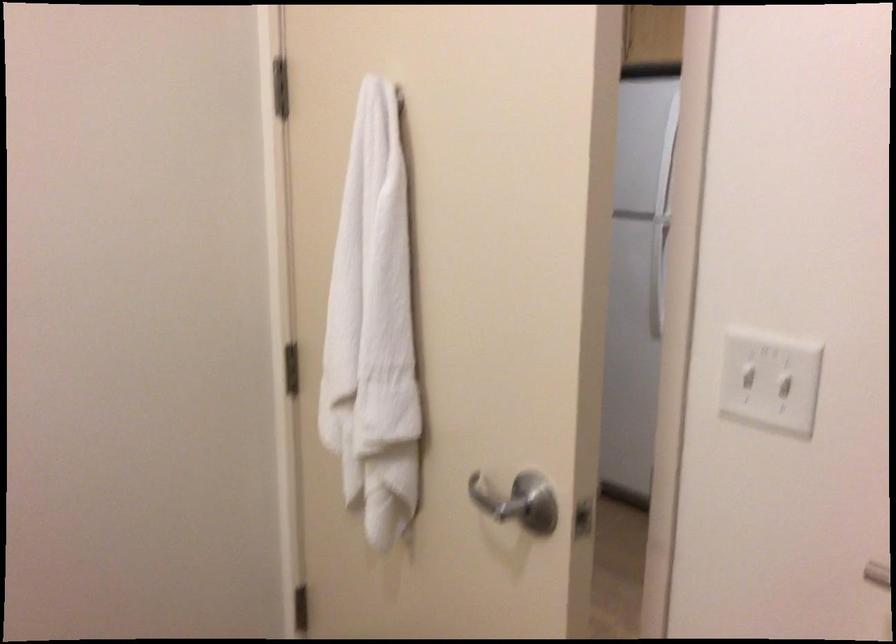
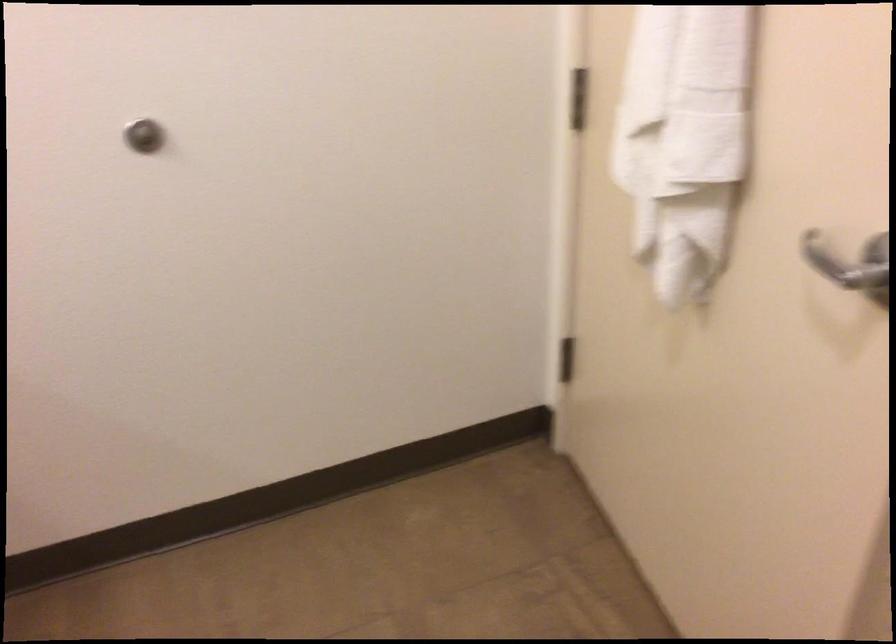
Based on the photo, the images are taken continuously from a first-person perspective. In which direction are you moving?

The movement direction of the cameraman is left, forward.